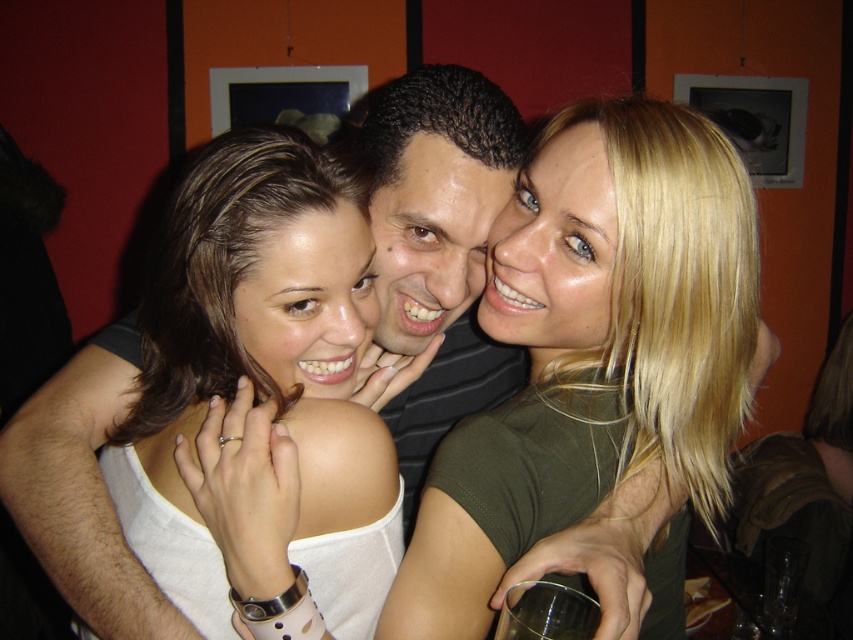
Does white matte tank top at center lie in front of dark brown curly hair at center?

Yes, white matte tank top at center is closer to the viewer.

Which is below, white matte tank top at center or dark brown curly hair at center?

white matte tank top at center is below.

Between point (253, 125) and point (375, 154), which one is positioned in front?

Point (253, 125) is more forward.

Where is `white matte tank top at center`? white matte tank top at center is located at coordinates (265, 321).

Does matte olive green shirt at center have a larger size compared to white matte tank top at center?

Yes, matte olive green shirt at center is bigger than white matte tank top at center.

Who is more forward, (622, 100) or (311, 536)?

Point (311, 536) is in front.

Between point (595, 508) and point (218, 205), which one is positioned behind?

Positioned behind is point (595, 508).

You are a GUI agent. You are given a task and a screenshot of the screen. Output one action in this format:
    pyautogui.click(x=<x>, y=<y>)
    Task: Click on the matte olive green shirt at center
    This screenshot has width=853, height=640.
    Given the screenshot: What is the action you would take?
    pyautogui.click(x=595, y=349)

Does matte olive green shirt at center appear on the left side of dark brown curly hair at center?

In fact, matte olive green shirt at center is to the right of dark brown curly hair at center.

Can you confirm if matte olive green shirt at center is taller than dark brown curly hair at center?

Yes.

Is point (663, 154) closer to camera compared to point (384, 157)?

Yes, it is in front of point (384, 157).

The image size is (853, 640). I want to click on matte olive green shirt at center, so click(595, 349).